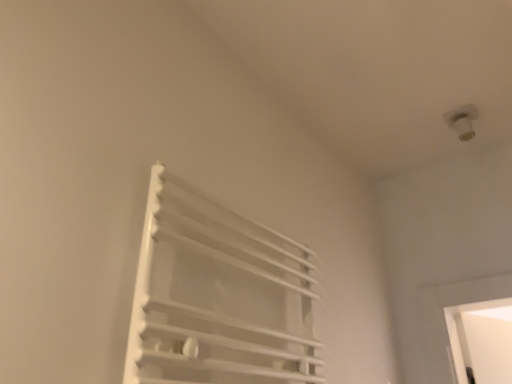
Describe the element at coordinates (218, 296) in the screenshot. I see `white glossy towel rack at center` at that location.

Where is `white glossy towel rack at center`? white glossy towel rack at center is located at coordinates (218, 296).

Locate an element on the screen. This screenshot has width=512, height=384. white glossy towel rack at center is located at coordinates (218, 296).